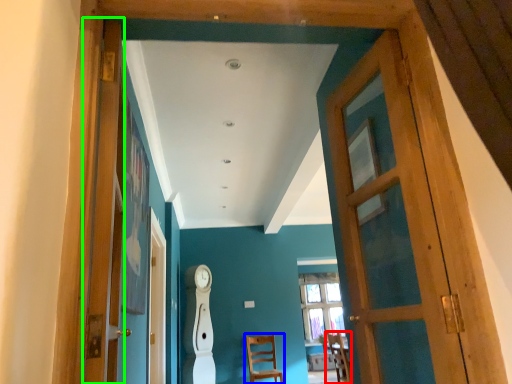
Question: Which object is the farthest from chair (highlighted by a red box)? Choose among these: chair (highlighted by a blue box) or door (highlighted by a green box).

Choices:
 (A) chair
 (B) door

Answer: (B)